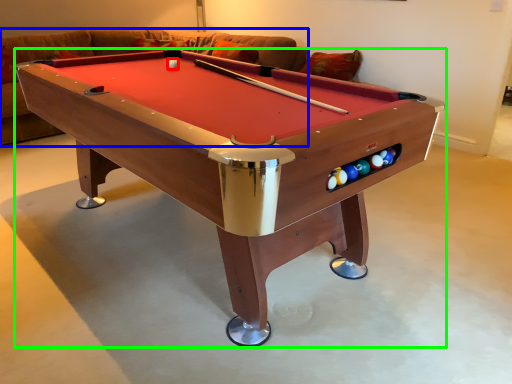
Question: Considering the real-world distances, which object is closest to ball (highlighted by a red box)? couch (highlighted by a blue box) or billiard table (highlighted by a green box).

Choices:
 (A) couch
 (B) billiard table

Answer: (B)